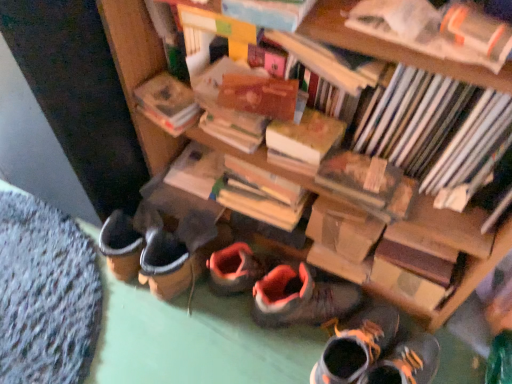
Where is `vacant space in front of orange suede sneaker at center, positioned as the first footwear in left-to-right order`? The image size is (512, 384). vacant space in front of orange suede sneaker at center, positioned as the first footwear in left-to-right order is located at coordinates (290, 353).